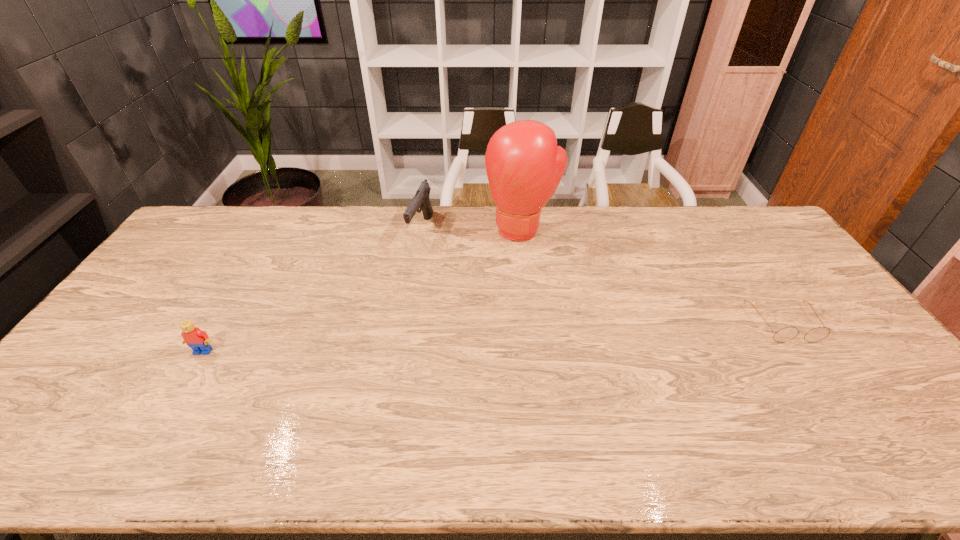
Identify the location of vacant space on the desktop that is between the Lego and the shortest object and is positioned on the striking surface of the third object from left to right. The image size is (960, 540). (483, 338).

You are a GUI agent. You are given a task and a screenshot of the screen. Output one action in this format:
    pyautogui.click(x=<x>, y=<y>)
    Task: Click on the free space on the desktop that is between the leftmost object and the rightmost object and is positioned at the muzzle of the gun
    The image size is (960, 540).
    Given the screenshot: What is the action you would take?
    tap(487, 338)